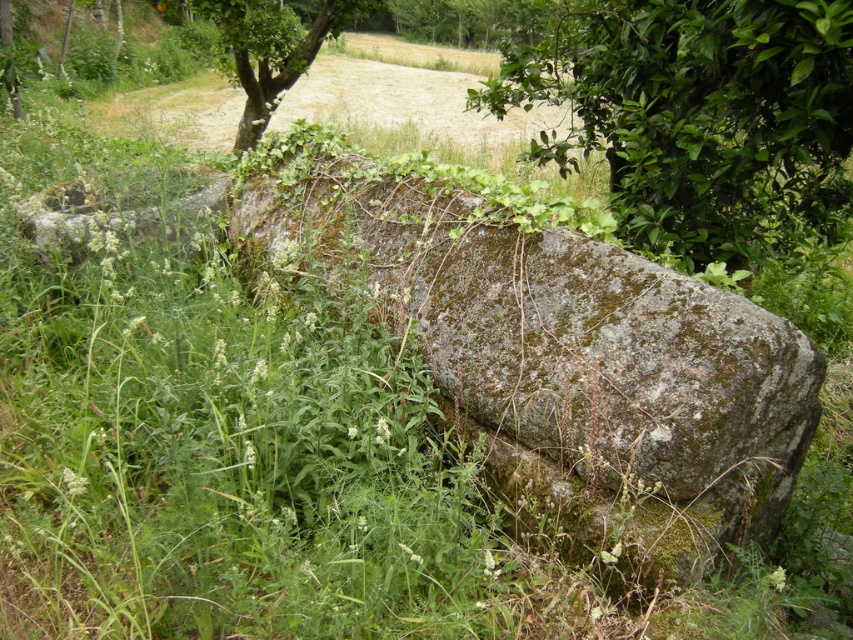
Question: Which of the following is the closest to the observer?

Choices:
 (A) green leafy tree at upper right
 (B) green leafy tree at upper left
 (C) mossy stone boulder at center

Answer: (C)

Question: Can you confirm if green leafy tree at upper right is positioned to the left of green leafy tree at upper left?

Choices:
 (A) yes
 (B) no

Answer: (B)

Question: Can you confirm if mossy stone boulder at center is smaller than green leafy tree at upper right?

Choices:
 (A) no
 (B) yes

Answer: (A)

Question: Which of the following is the closest to the observer?

Choices:
 (A) green leafy tree at upper right
 (B) green leafy tree at upper left
 (C) mossy stone boulder at center

Answer: (C)

Question: Is mossy stone boulder at center above green leafy tree at upper left?

Choices:
 (A) no
 (B) yes

Answer: (A)

Question: Estimate the real-world distances between objects in this image. Which object is closer to the green leafy tree at upper right?

Choices:
 (A) mossy stone boulder at center
 (B) green leafy tree at upper left

Answer: (A)